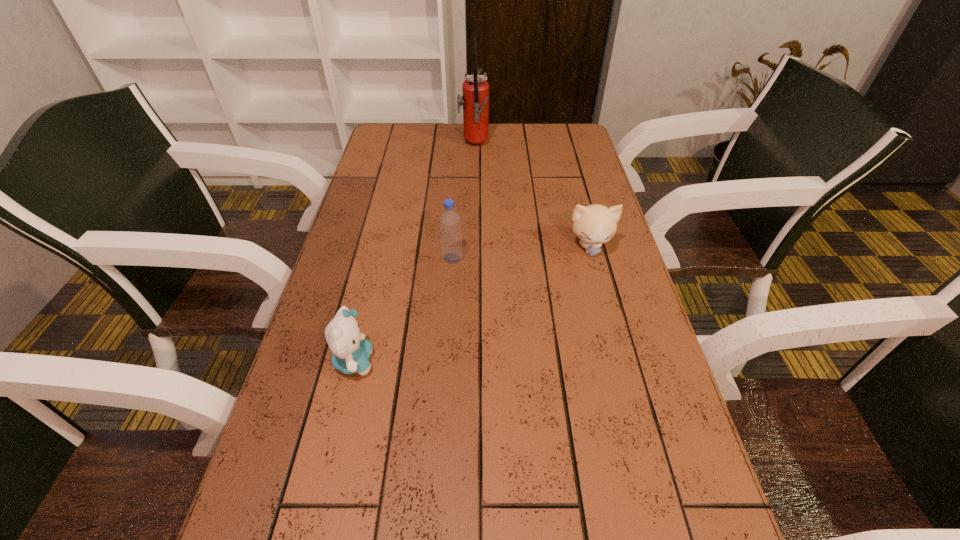
Locate an element on the screen. The width and height of the screenshot is (960, 540). free space between the third shortest object and the farthest object is located at coordinates (463, 202).

Where is `vacant space that is in between the rightmost object and the nearer kitten`? This screenshot has width=960, height=540. vacant space that is in between the rightmost object and the nearer kitten is located at coordinates (472, 304).

Find the location of a particular element. empty location between the left kitten and the third shortest object is located at coordinates (403, 310).

You are a GUI agent. You are given a task and a screenshot of the screen. Output one action in this format:
    pyautogui.click(x=<x>, y=<y>)
    Task: Click on the free spot between the farther kitten and the farthest object
    Image resolution: width=960 pixels, height=540 pixels.
    Given the screenshot: What is the action you would take?
    pyautogui.click(x=532, y=196)

Where is `free space between the bottle and the nearer kitten`? Image resolution: width=960 pixels, height=540 pixels. free space between the bottle and the nearer kitten is located at coordinates (403, 310).

At what (x,y) coordinates should I click in order to perform the action: click on free space between the leftmost object and the rightmost object. Please return your answer as a coordinate pair (x, y). The height and width of the screenshot is (540, 960). Looking at the image, I should click on (472, 304).

This screenshot has width=960, height=540. What are the coordinates of `vacant space that's between the bottle and the farther kitten` in the screenshot? It's located at (521, 253).

Identify the location of vacant space that's between the left kitten and the rightmost object. This screenshot has height=540, width=960. (472, 304).

Point out which object is positioned as the nearest to the fire extinguisher. Please provide its 2D coordinates. Your answer should be formatted as a tuple, i.e. [(x, y)], where the tuple contains the x and y coordinates of a point satisfying the conditions above.

[(595, 224)]

Select which object is the third closest to the bottle. Please provide its 2D coordinates. Your answer should be formatted as a tuple, i.e. [(x, y)], where the tuple contains the x and y coordinates of a point satisfying the conditions above.

[(475, 100)]